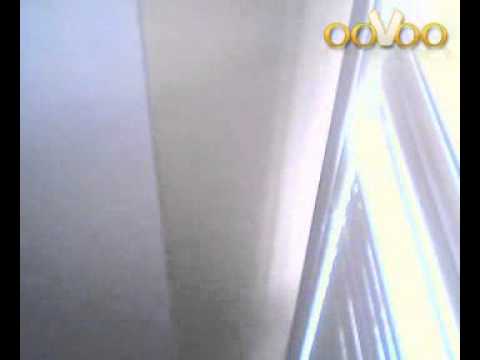
The width and height of the screenshot is (480, 360). I want to click on light, so click(x=408, y=279).